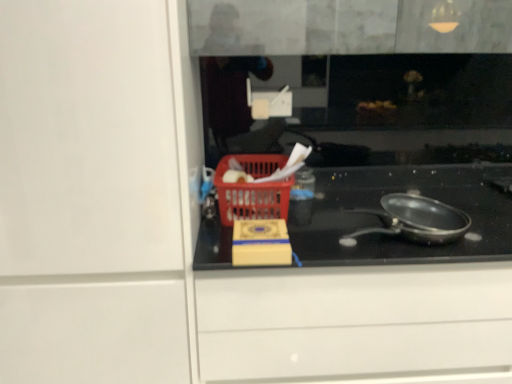
The width and height of the screenshot is (512, 384). What do you see at coordinates (253, 189) in the screenshot?
I see `red plastic basket at center` at bounding box center [253, 189].

The width and height of the screenshot is (512, 384). Describe the element at coordinates (415, 220) in the screenshot. I see `shiny black frying pan at center` at that location.

Find the location of a particular element. This screenshot has width=512, height=384. red plastic basket at center is located at coordinates (253, 189).

Considering the positions of objects black glass cooktop at center and shiny black frying pan at center in the image provided, who is behind, black glass cooktop at center or shiny black frying pan at center?

black glass cooktop at center is further away from the camera.

Looking at this image, is shiny black frying pan at center at the back of black glass cooktop at center?

That's not correct — black glass cooktop at center is not looking away from shiny black frying pan at center.

From a real-world perspective, is black glass cooktop at center positioned over shiny black frying pan at center based on gravity?

No, from a real-world perspective, black glass cooktop at center is not on top of shiny black frying pan at center.

Is red plastic basket at center bigger or smaller than shiny black frying pan at center?

Clearly, red plastic basket at center is larger in size than shiny black frying pan at center.

Is the depth of red plastic basket at center less than that of shiny black frying pan at center?

No, it is not.

From the image's perspective, is red plastic basket at center above shiny black frying pan at center?

Yes, from the image's perspective, red plastic basket at center is above shiny black frying pan at center.

Would you say red plastic basket at center contains shiny black frying pan at center?

That's incorrect, shiny black frying pan at center is not inside red plastic basket at center.

Is black glass cooktop at center not close to red plastic basket at center?

No, there isn't a large distance between black glass cooktop at center and red plastic basket at center.

Is point (511, 310) more distant than point (230, 199)?

That is False.

From their relative heights in the image, would you say black glass cooktop at center is taller or shorter than red plastic basket at center?

Clearly, black glass cooktop at center is taller compared to red plastic basket at center.

Is black glass cooktop at center inside or outside of red plastic basket at center?

black glass cooktop at center is not enclosed by red plastic basket at center.

Between shiny black frying pan at center and red plastic basket at center, which one appears on the left side from the viewer's perspective?

Positioned to the left is red plastic basket at center.

Can you confirm if shiny black frying pan at center is smaller than red plastic basket at center?

Correct, shiny black frying pan at center occupies less space than red plastic basket at center.

From the image's perspective, between shiny black frying pan at center and red plastic basket at center, which one is located above?

From the image's view, red plastic basket at center is above.

From a real-world perspective, is shiny black frying pan at center above or below red plastic basket at center?

In terms of real-world spatial position, shiny black frying pan at center is above red plastic basket at center.

Find the location of a particular element. This screenshot has height=384, width=512. cabinetry behind the shiny black frying pan at center is located at coordinates (362, 287).

From the image's perspective, is shiny black frying pan at center over black glass cooktop at center?

Yes.

How distant is shiny black frying pan at center from black glass cooktop at center?

shiny black frying pan at center and black glass cooktop at center are 6.75 inches apart from each other.

Can you confirm if shiny black frying pan at center is taller than black glass cooktop at center?

No.

Does red plastic basket at center have a smaller size compared to black glass cooktop at center?

Yes, red plastic basket at center is smaller than black glass cooktop at center.

Where is `basket on the left of black glass cooktop at center`? The height and width of the screenshot is (384, 512). basket on the left of black glass cooktop at center is located at coordinates (253, 189).

Is red plastic basket at center further to the viewer compared to black glass cooktop at center?

Yes, the depth of red plastic basket at center is greater than that of black glass cooktop at center.

From the picture: From the image's perspective, is red plastic basket at center on top of black glass cooktop at center?

Yes, from the image's perspective, red plastic basket at center is on top of black glass cooktop at center.

Find the location of a particular element. Image resolution: width=512 pixels, height=384 pixels. cabinetry below the shiny black frying pan at center (from a real-world perspective) is located at coordinates (362, 287).

In order to click on frying pan that is below the red plastic basket at center (from the image's perspective) in this screenshot , I will do `click(415, 220)`.

When comparing their distances from red plastic basket at center, does shiny black frying pan at center or black glass cooktop at center seem further?

Among the two, shiny black frying pan at center is located further to red plastic basket at center.

Estimate the real-world distances between objects in this image. Which object is further from black glass cooktop at center, red plastic basket at center or shiny black frying pan at center?

red plastic basket at center is positioned further to the anchor black glass cooktop at center.

Based on their spatial positions, is black glass cooktop at center or shiny black frying pan at center further from red plastic basket at center?

shiny black frying pan at center lies further to red plastic basket at center than the other object.

Estimate the real-world distances between objects in this image. Which object is closer to shiny black frying pan at center, red plastic basket at center or black glass cooktop at center?

The object closer to shiny black frying pan at center is black glass cooktop at center.

Consider the image. Looking at the image, which one is located closer to shiny black frying pan at center, black glass cooktop at center or red plastic basket at center?

black glass cooktop at center is closer to shiny black frying pan at center.

Consider the image. Estimate the real-world distances between objects in this image. Which object is closer to black glass cooktop at center, shiny black frying pan at center or red plastic basket at center?

shiny black frying pan at center is closer to black glass cooktop at center.

At what (x,y) coordinates should I click in order to perform the action: click on frying pan that lies between red plastic basket at center and black glass cooktop at center from top to bottom. Please return your answer as a coordinate pair (x, y). This screenshot has width=512, height=384. Looking at the image, I should click on (415, 220).